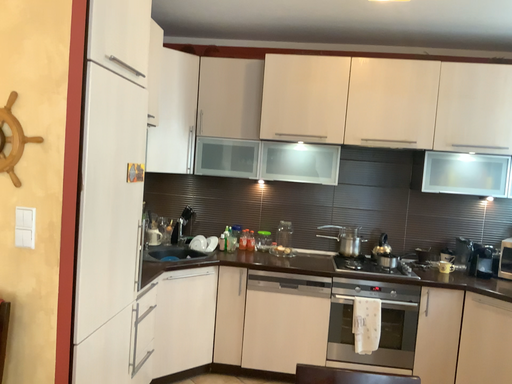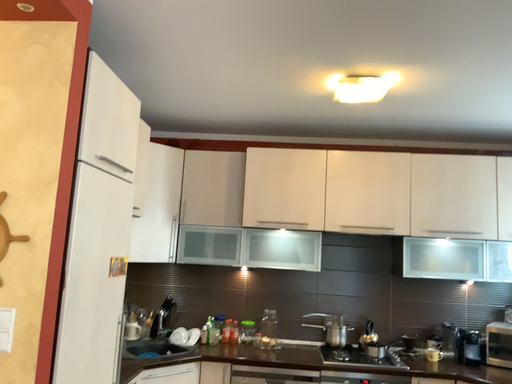
Question: How did the camera likely rotate when shooting the video?

Choices:
 (A) rotated downward
 (B) rotated upward

Answer: (B)